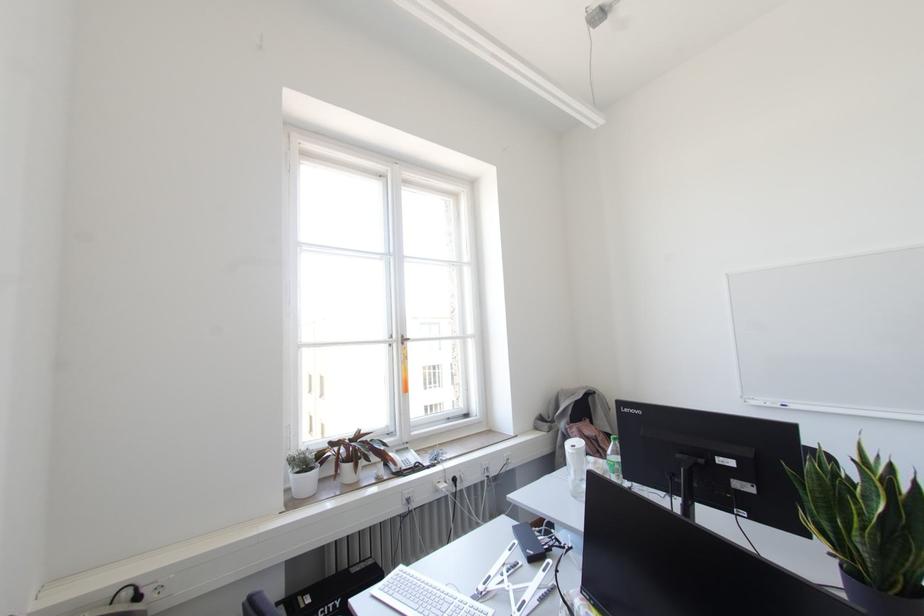
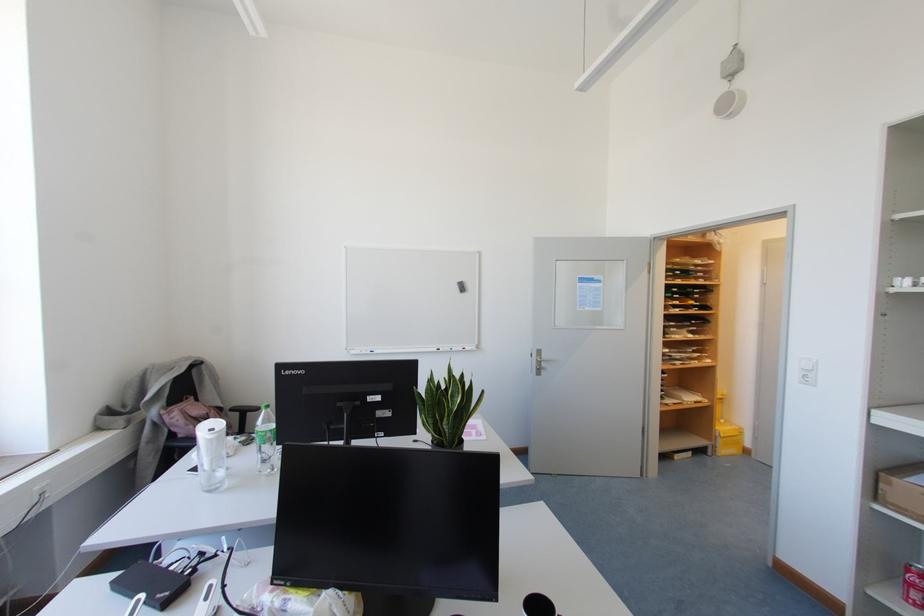
Question: Based on the continuous images, in which direction is the camera rotating? Reply with the corresponding letter.

Choices:
 (A) Left
 (B) Right
 (C) Up
 (D) Down

Answer: (B)